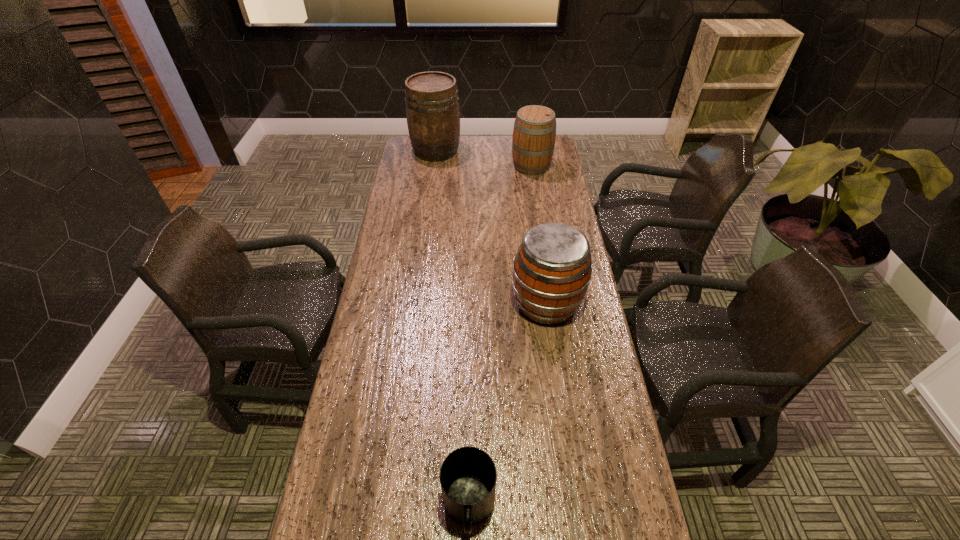
At what (x,y) coordinates should I click in order to perform the action: click on the leftmost object. Please return your answer as a coordinate pair (x, y). Looking at the image, I should click on (433, 115).

Locate an element on the screen. Image resolution: width=960 pixels, height=540 pixels. the leftmost cider is located at coordinates (433, 115).

Find the location of `the third farthest object`. the third farthest object is located at coordinates (552, 269).

I want to click on vacant space situated on the side of the leftmost cider near the bung hole, so click(x=525, y=151).

The height and width of the screenshot is (540, 960). Identify the location of vacant region located on the back of the second nearest object. (541, 265).

This screenshot has height=540, width=960. Find the location of `object that is at the left edge`. object that is at the left edge is located at coordinates (433, 115).

You are a GUI agent. You are given a task and a screenshot of the screen. Output one action in this format:
    pyautogui.click(x=<x>, y=<y>)
    Task: Click on the object present at the far left corner
    The width and height of the screenshot is (960, 540).
    Given the screenshot: What is the action you would take?
    pyautogui.click(x=433, y=115)

Where is `object that is at the far right corner`? object that is at the far right corner is located at coordinates (534, 133).

Identify the location of free space at the far edge of the desktop. (457, 159).

Locate an element on the screen. This screenshot has height=540, width=960. free location at the left edge is located at coordinates (427, 199).